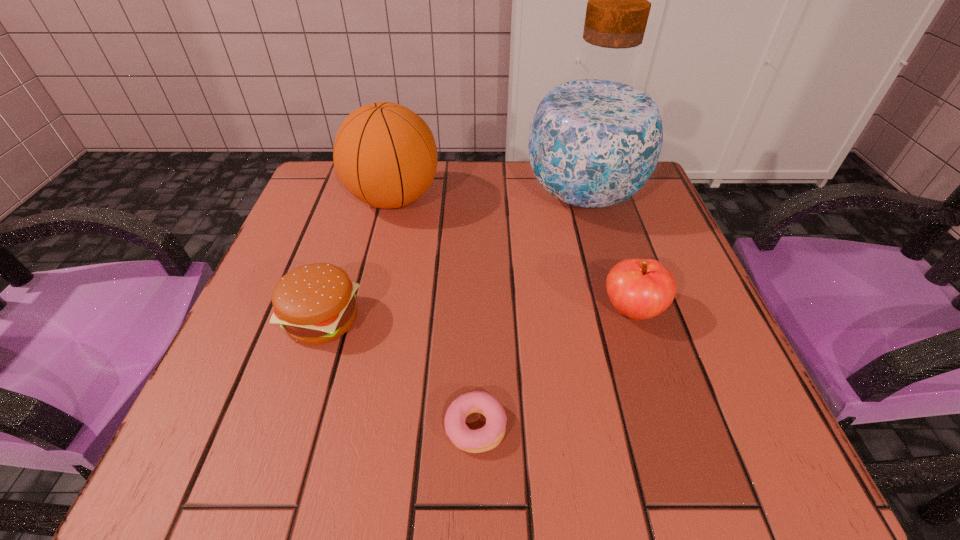
At what (x,y) coordinates should I click in order to perform the action: click on vacant area that lies between the nearest object and the hamburger. Please return your answer as a coordinate pair (x, y). This screenshot has width=960, height=540. Looking at the image, I should click on (399, 373).

This screenshot has width=960, height=540. Identify the location of free spot between the nearest object and the second tallest object. (435, 313).

At what (x,y) coordinates should I click in order to perform the action: click on empty location between the nearest object and the third shortest object. Please return your answer as a coordinate pair (x, y). Looking at the image, I should click on (554, 368).

This screenshot has width=960, height=540. In order to click on free space between the fourth shortest object and the apple in this screenshot , I will do `click(513, 255)`.

The height and width of the screenshot is (540, 960). I want to click on vacant point located between the apple and the hamburger, so click(x=477, y=315).

Image resolution: width=960 pixels, height=540 pixels. In order to click on unoccupied position between the apple and the second shortest object in this screenshot , I will do `click(477, 315)`.

The width and height of the screenshot is (960, 540). In order to click on free space that is in between the second shortest object and the tallest object in this screenshot , I will do (453, 258).

Select which object is the fourth closest to the doughnut. Please provide its 2D coordinates. Your answer should be formatted as a tuple, i.e. [(x, y)], where the tuple contains the x and y coordinates of a point satisfying the conditions above.

[(385, 155)]

The width and height of the screenshot is (960, 540). What are the coordinates of `object that is the closest to the hamburger` in the screenshot? It's located at (486, 438).

At what (x,y) coordinates should I click in order to perform the action: click on vacant point that satisfies the following two spatial constraints: 1. on the front side of the hamburger; 2. on the right side of the doughnut. Please return your answer as a coordinate pair (x, y). This screenshot has width=960, height=540. Looking at the image, I should click on (288, 426).